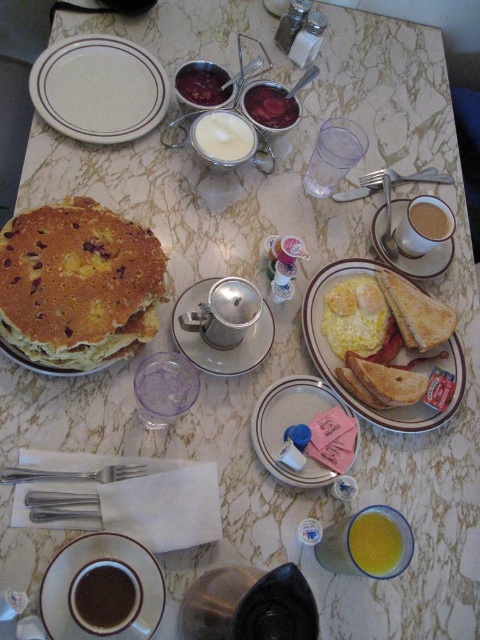
Is golden-brown crispy pancake at center-left further to the viewer compared to matte ceramic saucer at lower left?

Yes, it is behind matte ceramic saucer at lower left.

Describe the element at coordinates (78, 285) in the screenshot. I see `golden-brown crispy pancake at center-left` at that location.

Looking at this image, who is more distant from viewer, (50, 326) or (108, 609)?

The point (50, 326) is more distant.

The image size is (480, 640). What are the coordinates of `golden-brown crispy pancake at center-left` in the screenshot? It's located at point(78,285).

Is matte ceramic saucer at lower left closer to the viewer compared to matte white plate at center?

Yes, it is.

Does point (134, 545) come behind point (447, 353)?

That is False.

Image resolution: width=480 pixels, height=640 pixels. I want to click on matte ceramic saucer at lower left, so click(x=101, y=589).

Is matte white plate at center below white ceramic saucer at center?

Yes, matte white plate at center is below white ceramic saucer at center.

Between matte white plate at center and white ceramic saucer at center, which one appears on the left side from the viewer's perspective?

matte white plate at center is more to the left.

Is point (324, 276) in front of point (451, 240)?

Yes, point (324, 276) is in front of point (451, 240).

Identify the location of matte white plate at center. Image resolution: width=480 pixels, height=640 pixels. (394, 360).